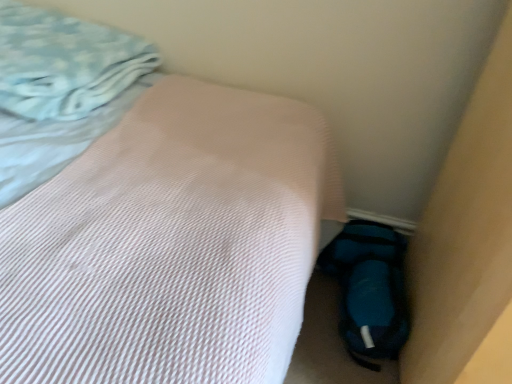
Find the location of a particular element. The height and width of the screenshot is (384, 512). vacant point above blue fuzzy sleeping bag at lower right (from a real-world perspective) is located at coordinates (379, 296).